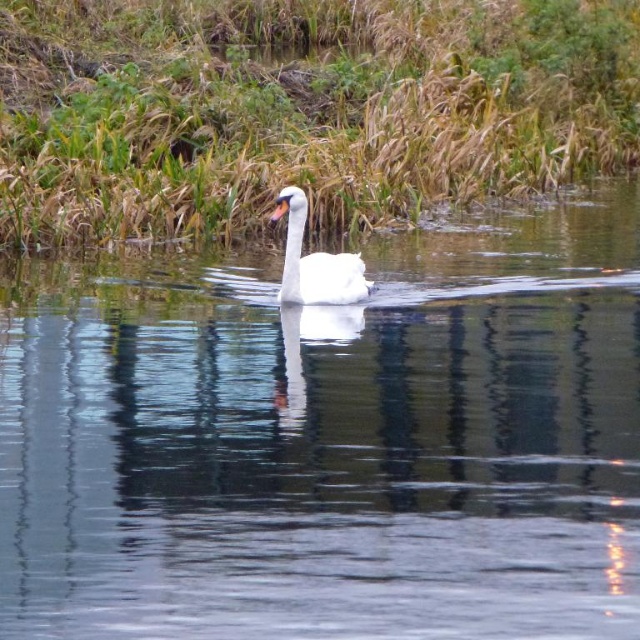
You are a photographer wanting to capture the white glossy swan at center and the green grass at center in a single shot. Based on their positions, which object would appear closer to the camera?

The green grass at center appears closer to the camera because the white glossy swan at center is positioned behind it.